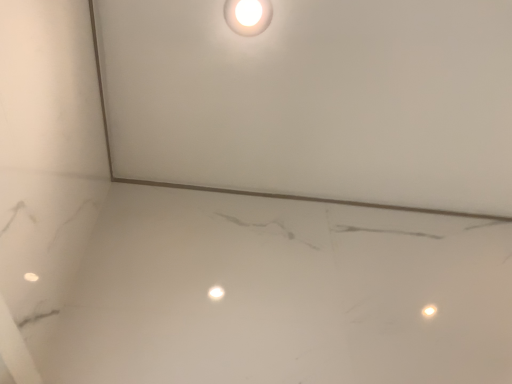
What do you see at coordinates (248, 16) in the screenshot? I see `white glossy light fixture at upper center` at bounding box center [248, 16].

In order to click on white glossy light fixture at upper center in this screenshot , I will do `click(248, 16)`.

What is the approximate width of white glossy light fixture at upper center?

The width of white glossy light fixture at upper center is 3.92 inches.

You are a GUI agent. You are given a task and a screenshot of the screen. Output one action in this format:
    pyautogui.click(x=<x>, y=<y>)
    Task: Click on the white glossy light fixture at upper center
    
    Given the screenshot: What is the action you would take?
    pyautogui.click(x=248, y=16)